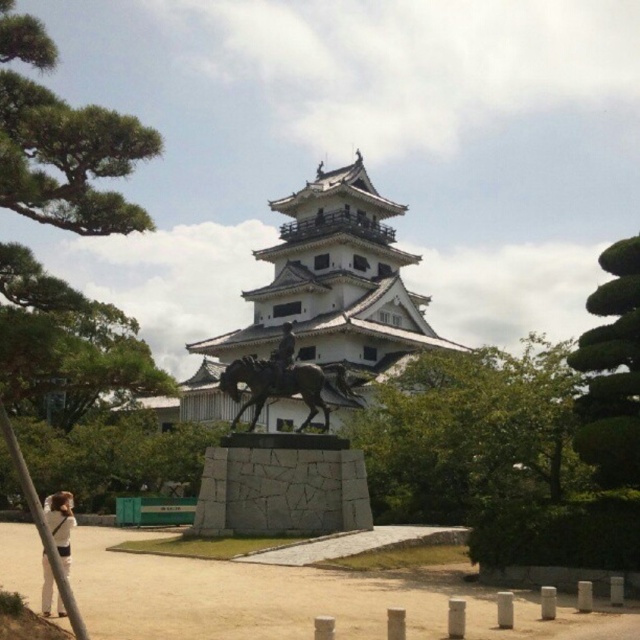
Question: From the image, what is the correct spatial relationship of green leafy tree at center in relation to white fabric at lower left?

Choices:
 (A) right
 (B) left

Answer: (A)

Question: Which of the following is the farthest from the observer?

Choices:
 (A) green leafy tree at upper left
 (B) green leafy tree at center right
 (C) green leafy tree at lower left
 (D) shiny bronze horse at center

Answer: (C)

Question: Does shiny bronze horse at center have a greater width compared to white fabric at lower left?

Choices:
 (A) yes
 (B) no

Answer: (B)

Question: Is white stone tower at center to the left of shiny bronze horse at center from the viewer's perspective?

Choices:
 (A) yes
 (B) no

Answer: (A)

Question: Which point is farther to the camera?

Choices:
 (A) white fabric at lower left
 (B) green leafy tree at center right
 (C) green leafy tree at center
 (D) white stone tower at center

Answer: (D)

Question: Among these objects, which one is farthest from the camera?

Choices:
 (A) green leafy tree at center right
 (B) green leafy tree at center
 (C) white fabric at lower left
 (D) white stone tower at center

Answer: (D)